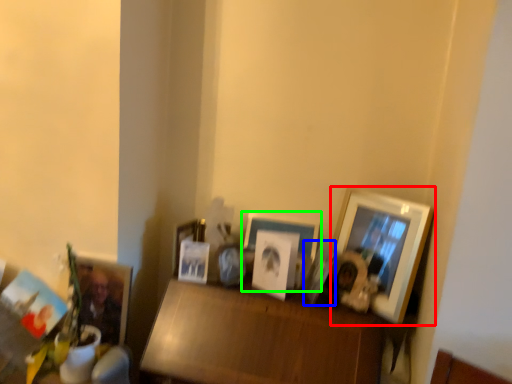
Question: Which object is the farthest from picture frame (highlighted by a red box)? Choose among these: picture frame (highlighted by a blue box) or picture frame (highlighted by a green box).

Choices:
 (A) picture frame
 (B) picture frame

Answer: (B)